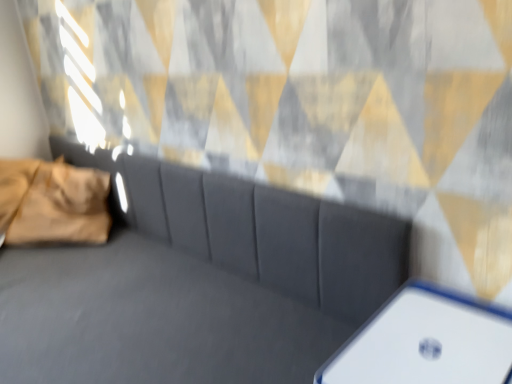
Question: Looking at the image, does white plastic phone at lower right seem bigger or smaller compared to suede gray couch at center?

Choices:
 (A) big
 (B) small

Answer: (B)

Question: Considering the positions of white plastic phone at lower right and suede gray couch at center in the image, is white plastic phone at lower right taller or shorter than suede gray couch at center?

Choices:
 (A) tall
 (B) short

Answer: (B)

Question: Which object is the closest to the suede gray couch at center?

Choices:
 (A) golden velvet pillow at left
 (B) white plastic phone at lower right

Answer: (B)

Question: Estimate the real-world distances between objects in this image. Which object is closer to the golden velvet pillow at left?

Choices:
 (A) white plastic phone at lower right
 (B) suede gray couch at center

Answer: (B)